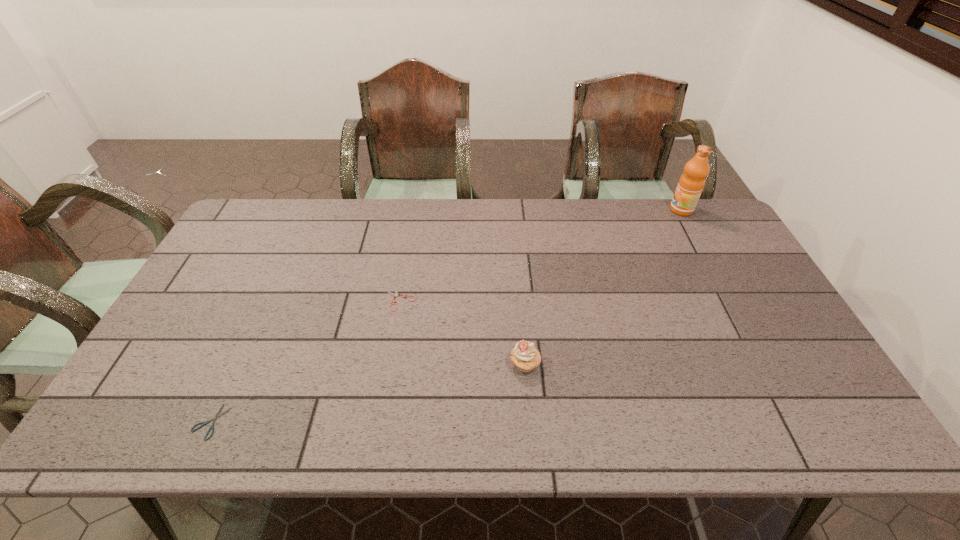
What are the coordinates of `vacant area located on the label side of the rightmost object` in the screenshot? It's located at (565, 210).

Identify the location of vacant space located 0.280m on the right of the cupcake. (652, 364).

The height and width of the screenshot is (540, 960). I want to click on free spot located 0.250m on the back of the right shears, so click(x=412, y=233).

The width and height of the screenshot is (960, 540). I want to click on vacant space located on the left of the leftmost object, so click(x=111, y=421).

Image resolution: width=960 pixels, height=540 pixels. I want to click on object at the far edge, so click(x=691, y=183).

Locate an element on the screen. This screenshot has width=960, height=540. object present at the near edge is located at coordinates (217, 415).

At what (x,y) coordinates should I click in order to perform the action: click on object that is positioned at the right edge. Please return your answer as a coordinate pair (x, y). Looking at the image, I should click on (691, 183).

Find the location of a particular element. The image size is (960, 540). object present at the far right corner is located at coordinates (691, 183).

This screenshot has height=540, width=960. Find the location of `vacant region at the far edge`. vacant region at the far edge is located at coordinates (653, 240).

Locate an element on the screen. Image resolution: width=960 pixels, height=540 pixels. blank space at the near edge is located at coordinates (468, 435).